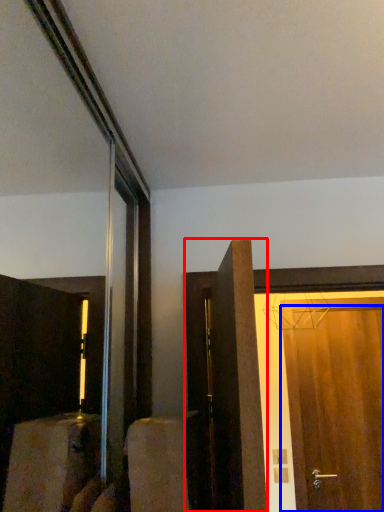
Question: Among these objects, which one is nearest to the camera, door (highlighted by a red box) or door (highlighted by a blue box)?

Choices:
 (A) door
 (B) door

Answer: (A)